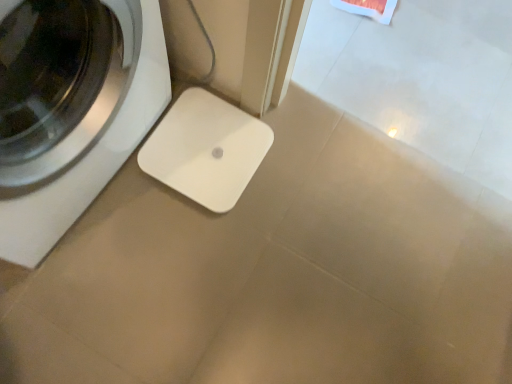
Find the location of a particular element. white glossy washing machine at left is located at coordinates (71, 109).

What do you see at coordinates (71, 109) in the screenshot?
I see `white glossy washing machine at left` at bounding box center [71, 109].

Identify the location of white glossy washing machine at left. (71, 109).